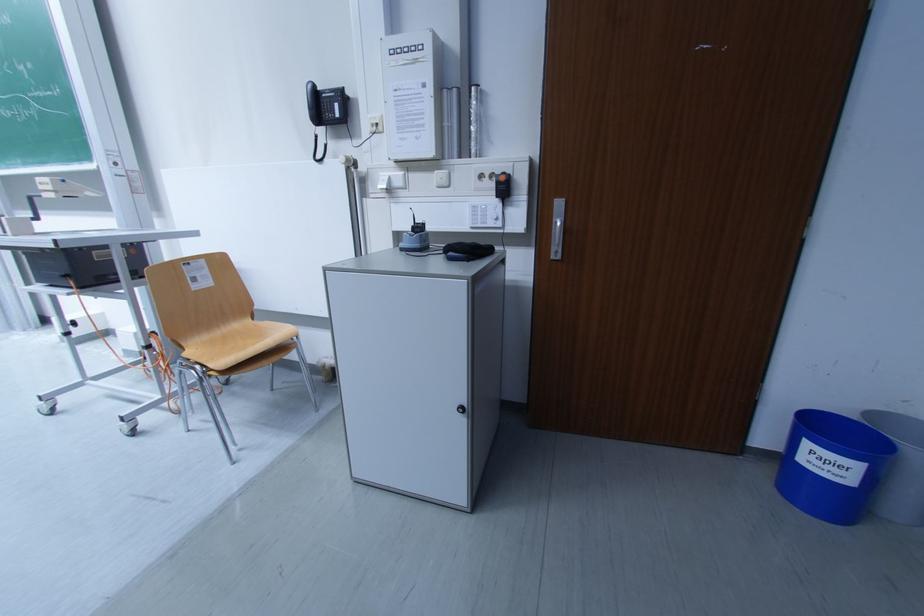
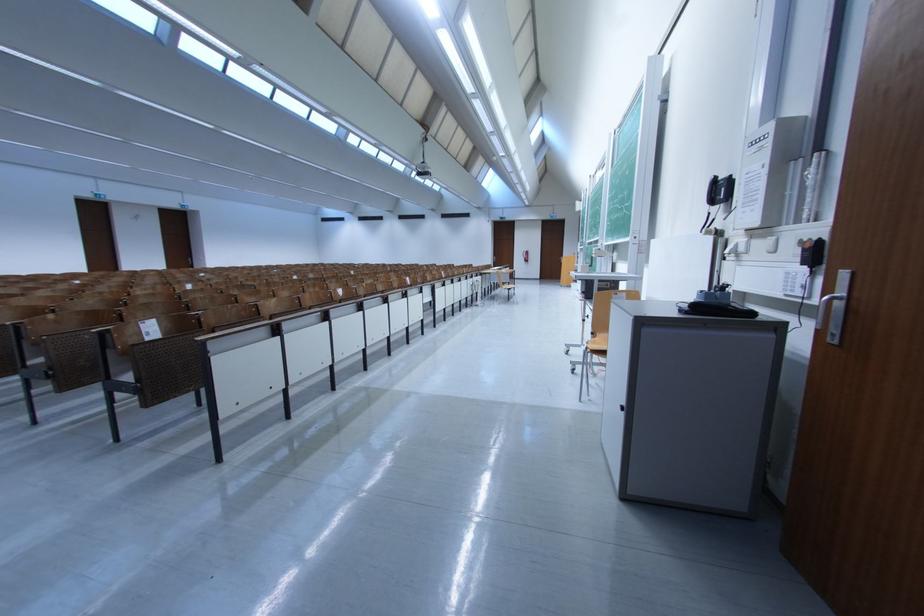
Where in the second image is the point corresponding to (469,411) from the first image?

(631, 410)